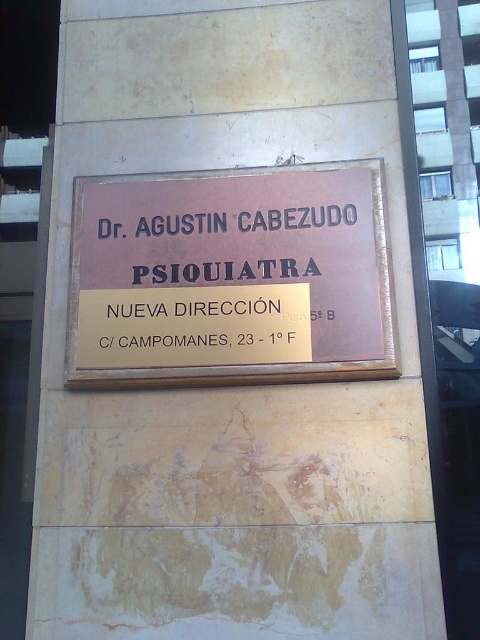
Does brown polished wood sign at center have a lesser height compared to gold metallic sign at center?

Incorrect, brown polished wood sign at center's height does not fall short of gold metallic sign at center's.

Can you confirm if brown polished wood sign at center is smaller than gold metallic sign at center?

No.

Which is in front, point (241, 186) or point (159, 268)?

Positioned in front is point (159, 268).

At what (x,y) coordinates should I click in order to perform the action: click on brown polished wood sign at center. Please return your answer as a coordinate pair (x, y). This screenshot has width=480, height=640. Looking at the image, I should click on (231, 276).